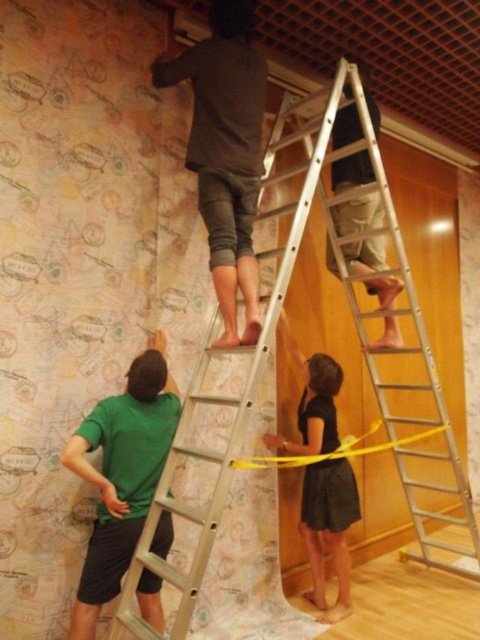
Question: Among these objects, which one is nearest to the camera?

Choices:
 (A) light brown wood ladder at upper center
 (B) dark gray fabric pants at upper center

Answer: (B)

Question: Among these objects, which one is nearest to the camera?

Choices:
 (A) silver metallic ladder at upper center
 (B) dark gray fabric pants at upper center
 (C) silver metallic ladder at center
 (D) yellow/yellowish plastic tape at lower center

Answer: (C)

Question: Which object is positioned farthest from the dark gray fabric pants at upper center?

Choices:
 (A) green cotton shirt at lower left
 (B) yellow/yellowish plastic tape at lower center
 (C) silver metallic ladder at upper center

Answer: (B)

Question: From the image, what is the correct spatial relationship of silver metallic ladder at center in relation to dark gray fabric pants at upper center?

Choices:
 (A) below
 (B) above

Answer: (A)

Question: Does dark gray fabric pants at upper center have a larger size compared to black matte dress at lower center?

Choices:
 (A) yes
 (B) no

Answer: (A)

Question: Is dark gray fabric pants at upper center behind yellow/yellowish plastic tape at lower center?

Choices:
 (A) yes
 (B) no

Answer: (B)